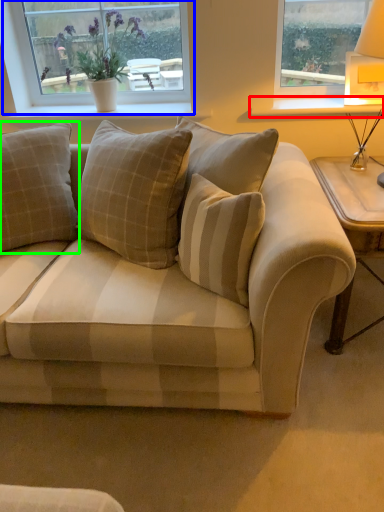
Question: Considering the real-world distances, which object is farthest from window sill (highlighted by a red box)? window (highlighted by a blue box) or pillow (highlighted by a green box)?

Choices:
 (A) window
 (B) pillow

Answer: (B)